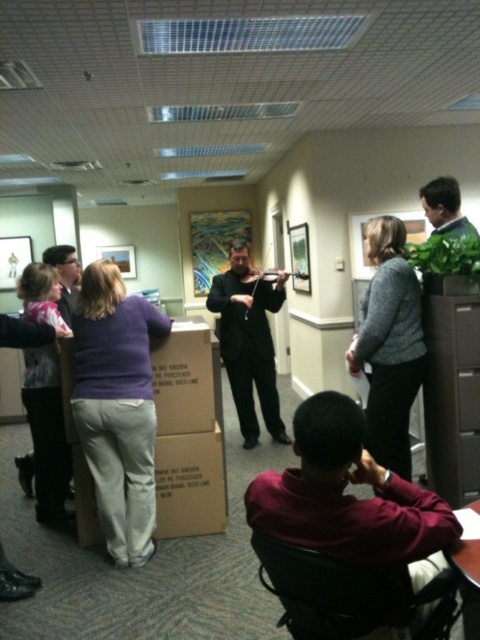
Consider the image. Does black matte suit at center have a lesser height compared to wooden violin at center?

No, black matte suit at center is not shorter than wooden violin at center.

At what (x,y) coordinates should I click in order to perform the action: click on black matte suit at center. Please return your answer as a coordinate pair (x, y). Image resolution: width=480 pixels, height=640 pixels. Looking at the image, I should click on (249, 340).

Is point (152, 419) in front of point (397, 280)?

No, it is behind (397, 280).

Does purple matte sweater at center have a lesser height compared to gray woolen sweater at center?

No.

Where is `purple matte sweater at center`? This screenshot has height=640, width=480. purple matte sweater at center is located at coordinates (118, 406).

Can you confirm if gray woolen sweater at center is thinner than black matte suit at center?

Indeed, gray woolen sweater at center has a lesser width compared to black matte suit at center.

Looking at this image, measure the distance between gray woolen sweater at center and camera.

A distance of 2.72 meters exists between gray woolen sweater at center and camera.

Is point (385, 218) farther from camera compared to point (211, 301)?

No, (385, 218) is closer to viewer.

Find the location of a particular element. The width and height of the screenshot is (480, 640). gray woolen sweater at center is located at coordinates (389, 344).